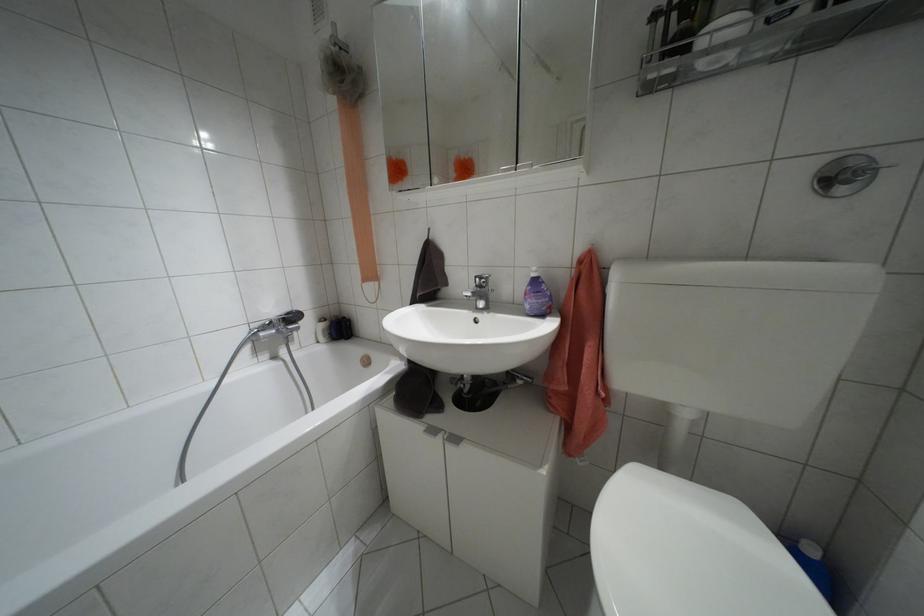
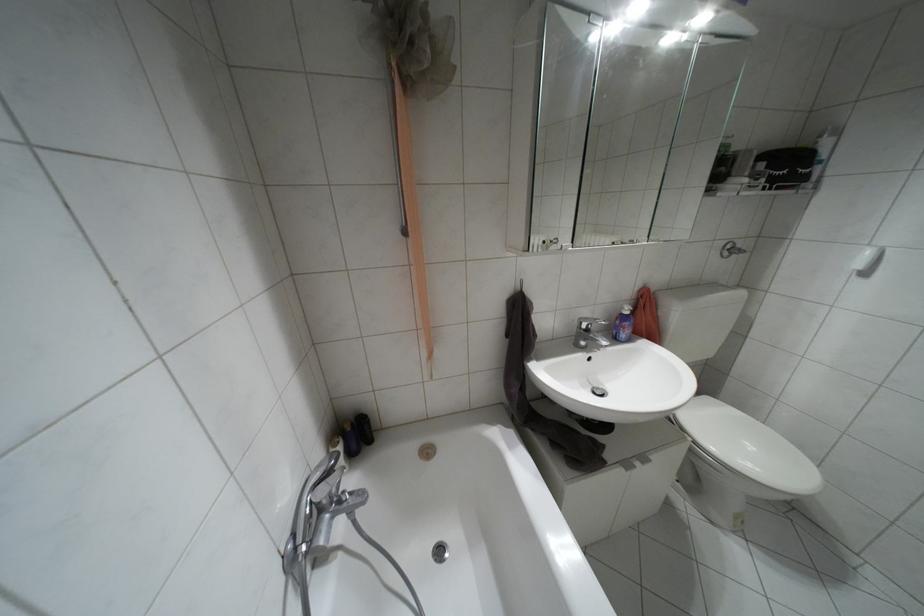
The point at (479, 286) is marked in the first image. Where is the corresponding point in the second image?

(587, 330)